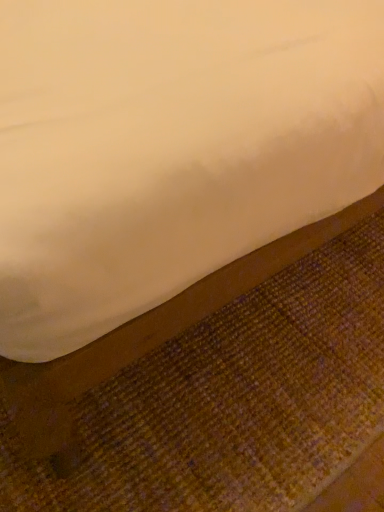
This screenshot has height=512, width=384. What are the coordinates of `white fabric bed at lower right` in the screenshot? It's located at (169, 148).

Describe the element at coordinates (169, 148) in the screenshot. Image resolution: width=384 pixels, height=512 pixels. I see `white fabric bed at lower right` at that location.

Where is `white fabric bed at lower right`? white fabric bed at lower right is located at coordinates (169, 148).